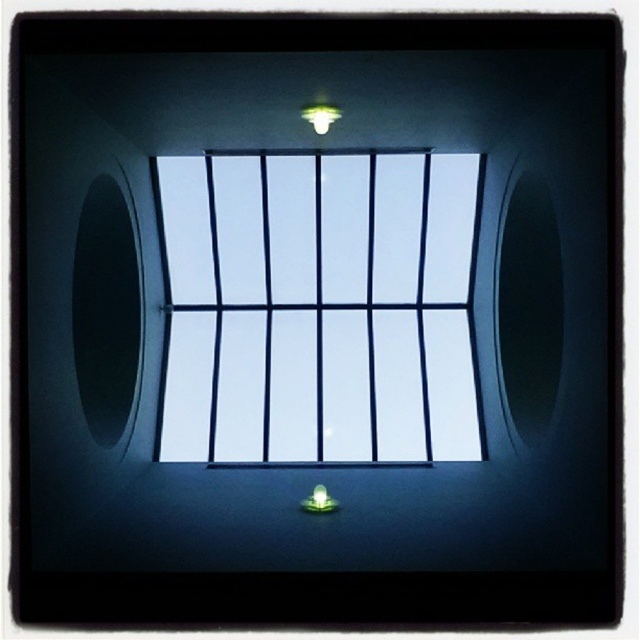
Question: Which point appears farthest from the camera in this image?

Choices:
 (A) tap(454, 413)
 (B) tap(320, 120)

Answer: (A)

Question: Does transparent glass window at center appear on the right side of matte white light at upper center?

Choices:
 (A) no
 (B) yes

Answer: (A)

Question: Which point is closer to the camera?

Choices:
 (A) (209, 333)
 (B) (324, 125)

Answer: (B)

Question: Can you confirm if transparent glass window at center is wider than matte white light at upper center?

Choices:
 (A) yes
 (B) no

Answer: (A)

Question: Which point is farther from the camera taking this photo?

Choices:
 (A) (170, 429)
 (B) (333, 113)

Answer: (A)

Question: Does transparent glass window at center appear on the left side of matte white light at upper center?

Choices:
 (A) yes
 (B) no

Answer: (A)